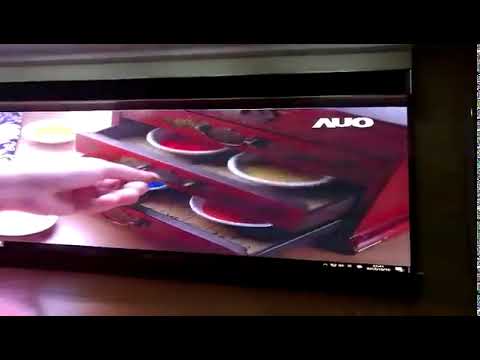
Locate an element on the screen. This screenshot has height=360, width=480. drawer pulls is located at coordinates (135, 219), (224, 141), (266, 111).